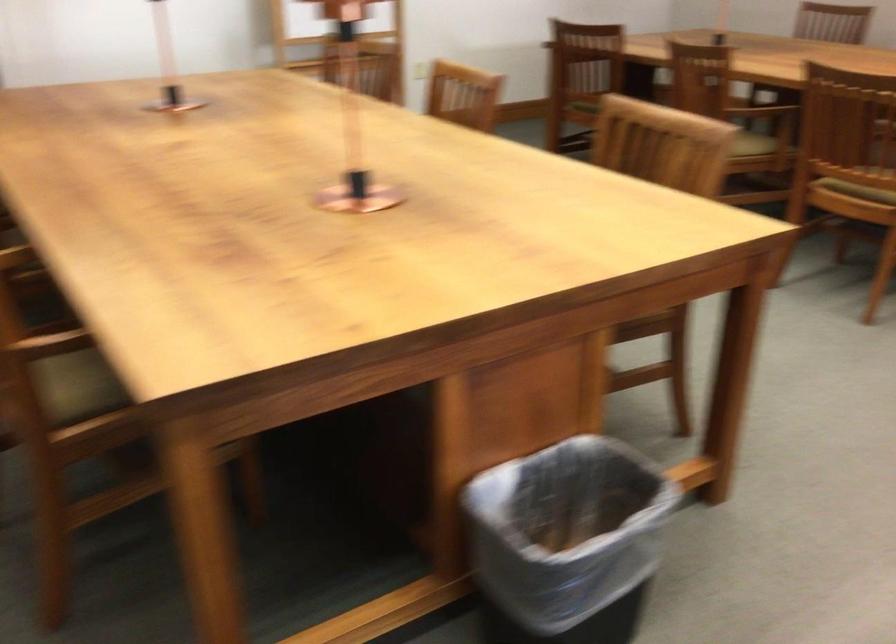
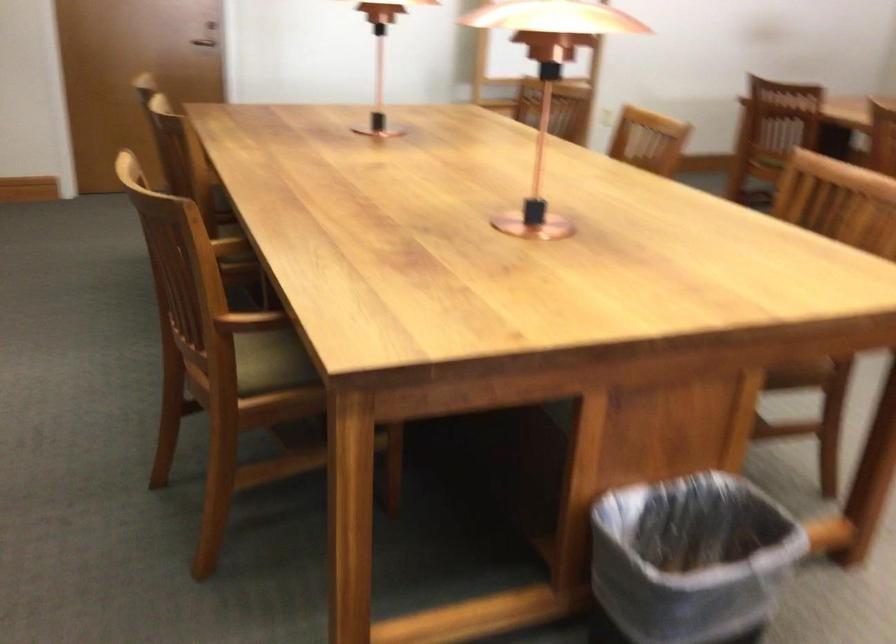
Locate, in the second image, the point that corresponds to [96,381] in the first image.

(271, 362)